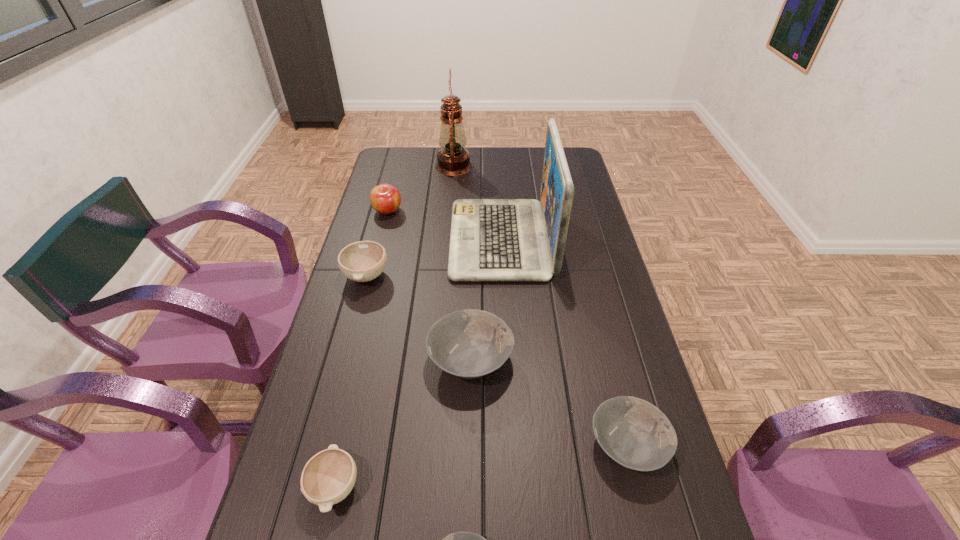
The width and height of the screenshot is (960, 540). What are the coordinates of `oil lamp` in the screenshot? It's located at (453, 159).

The width and height of the screenshot is (960, 540). What are the coordinates of `laptop computer` in the screenshot? It's located at (492, 240).

Find the location of `the third tallest object`. the third tallest object is located at coordinates (384, 198).

The image size is (960, 540). I want to click on the farthest bowl, so click(362, 261).

Where is `the farther beige bowl`? the farther beige bowl is located at coordinates (362, 261).

At what (x,y) coordinates should I click in order to perform the action: click on the fourth nearest object. Please return your answer as a coordinate pair (x, y). Looking at the image, I should click on pos(470,343).

This screenshot has width=960, height=540. Identify the location of the fourth nearest bowl. (x=470, y=343).

Locate an element on the screen. the rightmost gray bowl is located at coordinates (634, 433).

Where is `the rightmost bowl`? the rightmost bowl is located at coordinates (634, 433).

Identify the location of the smaller beige bowl. This screenshot has width=960, height=540. (328, 477).